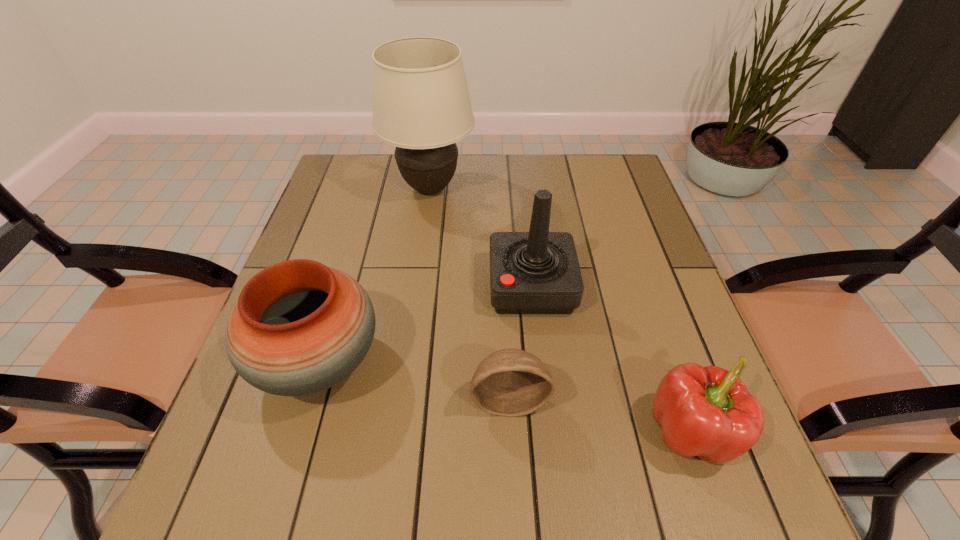
The width and height of the screenshot is (960, 540). Find the location of `free region at the left edge`. free region at the left edge is located at coordinates (354, 226).

Where is `vacant space at the right edge of the desktop`? This screenshot has height=540, width=960. vacant space at the right edge of the desktop is located at coordinates (689, 361).

You are a GUI agent. You are given a task and a screenshot of the screen. Output one action in this format:
    pyautogui.click(x=<x>, y=<y>)
    Task: Click on the blank space at the far left corner of the desktop
    The image size is (960, 540).
    Given the screenshot: What is the action you would take?
    pyautogui.click(x=357, y=194)

Image resolution: width=960 pixels, height=540 pixels. I want to click on vacant area at the far right corner, so click(x=606, y=153).

In the image, there is a desktop. Identify the location of vacant space at the near right corner. tap(734, 510).

What are the coordinates of `vacant area between the pottery and the bowl` in the screenshot? It's located at (x=415, y=381).

Identify the location of unoccupied area between the third shortest object and the tallest object. (374, 275).

Where is `unoccupied area between the pottery and the bowl`? unoccupied area between the pottery and the bowl is located at coordinates (415, 381).

Locate an element on the screen. This screenshot has height=540, width=960. unoccupied position between the bowl and the rightmost object is located at coordinates (600, 415).

The image size is (960, 540). I want to click on vacant region between the pottery and the lampshade, so click(374, 275).